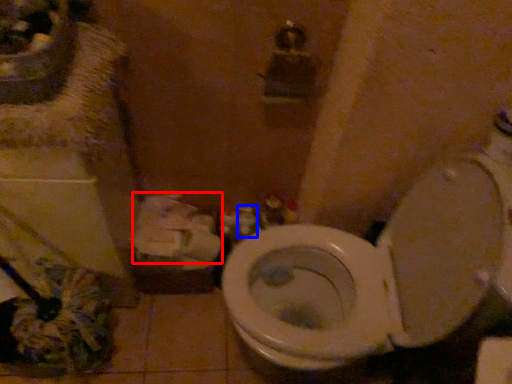
Question: Which of the following is the closest to the observer, toilet paper (highlighted by a red box) or toiletry (highlighted by a blue box)?

Choices:
 (A) toilet paper
 (B) toiletry

Answer: (A)